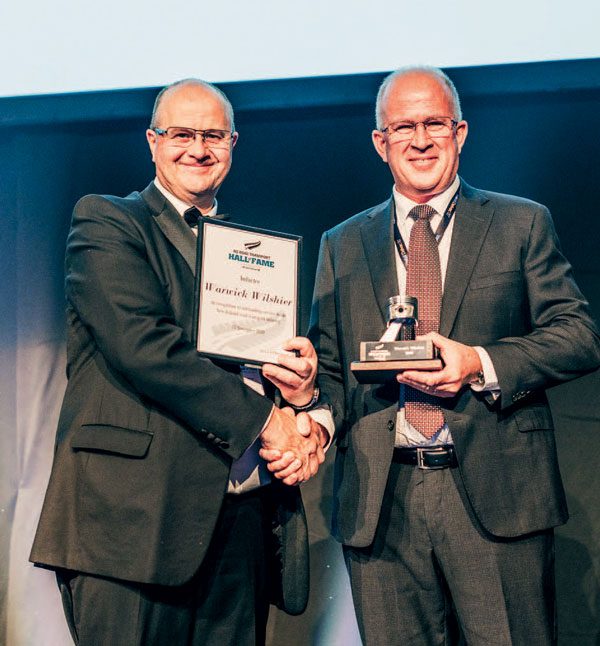
The width and height of the screenshot is (600, 646). In order to click on award in this screenshot , I will do `click(425, 349)`.